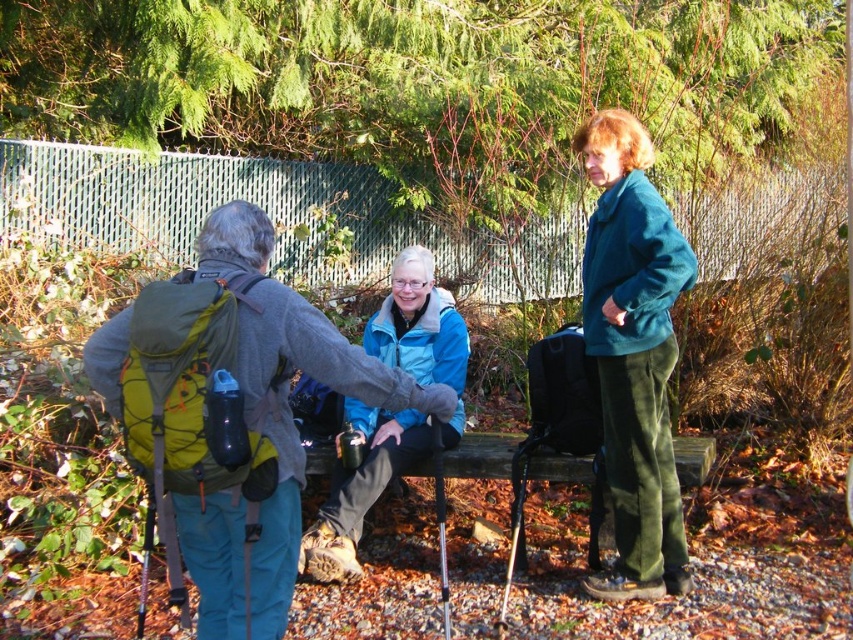
Question: Does green fabric backpack at left have a smaller size compared to teal fleece jacket at upper right?

Choices:
 (A) no
 (B) yes

Answer: (A)

Question: Can you confirm if green fabric backpack at left is positioned below blue fleece jacket at center?

Choices:
 (A) no
 (B) yes

Answer: (A)

Question: Can you confirm if green fabric backpack at left is smaller than blue fleece jacket at center?

Choices:
 (A) no
 (B) yes

Answer: (B)

Question: Which point is closer to the camera taking this photo?

Choices:
 (A) (138, 369)
 (B) (653, 481)
 (C) (401, 291)

Answer: (A)

Question: Which point is farther from the camera taking this photo?

Choices:
 (A) (248, 456)
 (B) (367, 461)

Answer: (B)

Question: Which object is closer to the camera taking this photo?

Choices:
 (A) blue fleece jacket at center
 (B) green fabric backpack at left

Answer: (B)